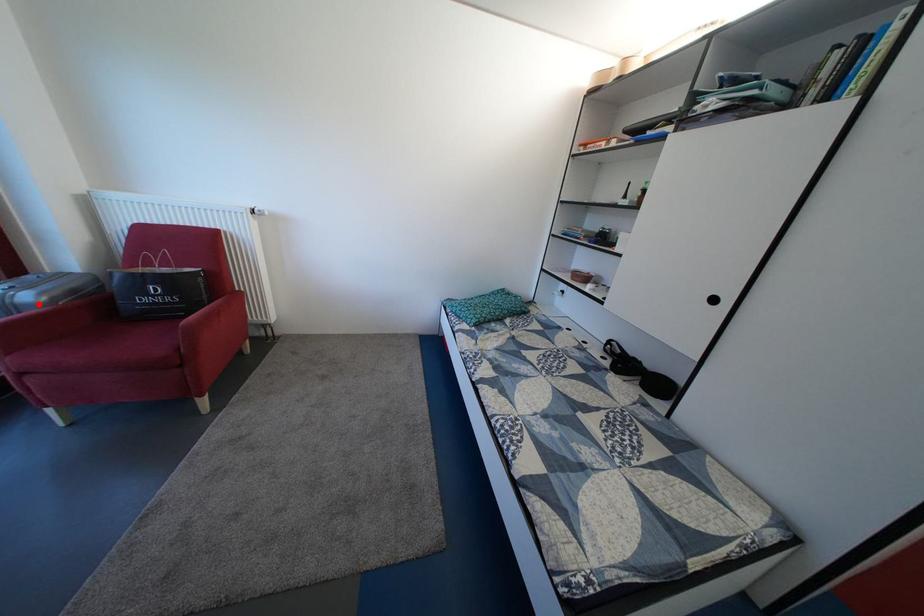
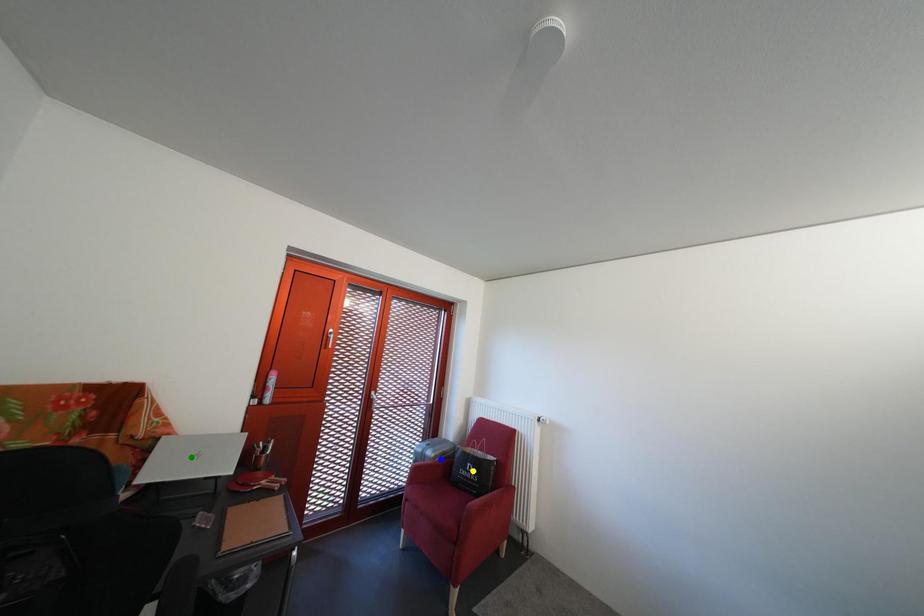
Question: I am providing you with two images of the same scene from different viewpoints. A red point is marked on the first image. You are given multiple points on the second image. In image 2, which mark is for the same physical point as the one in image 1?

Choices:
 (A) green point
 (B) blue point
 (C) yellow point

Answer: (B)